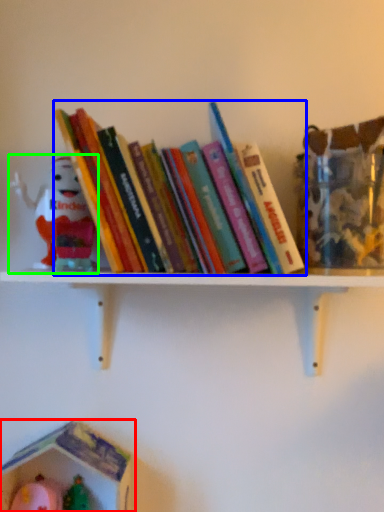
Question: Which is farther away from toy (highlighted by a red box)? book (highlighted by a blue box) or toy (highlighted by a green box)?

Choices:
 (A) book
 (B) toy

Answer: (A)